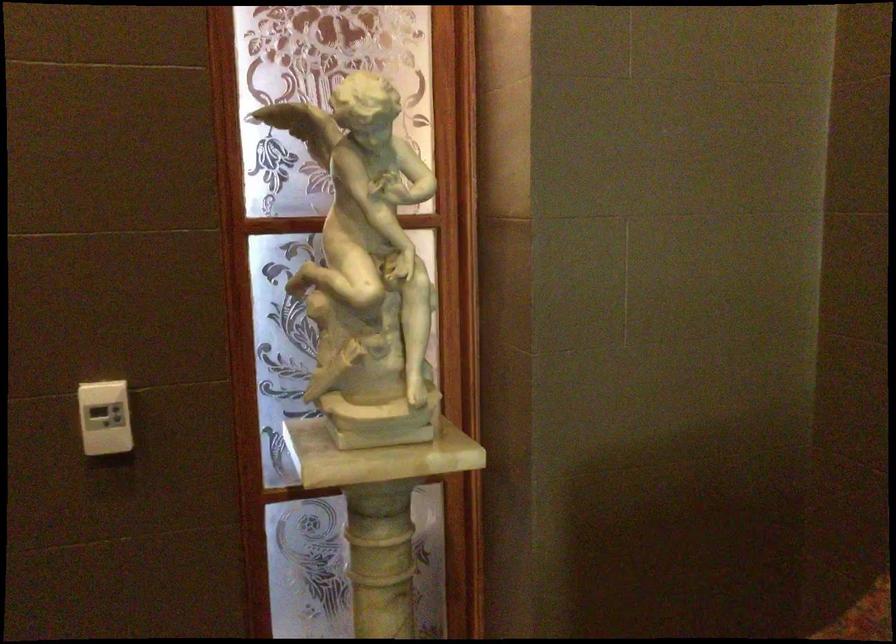
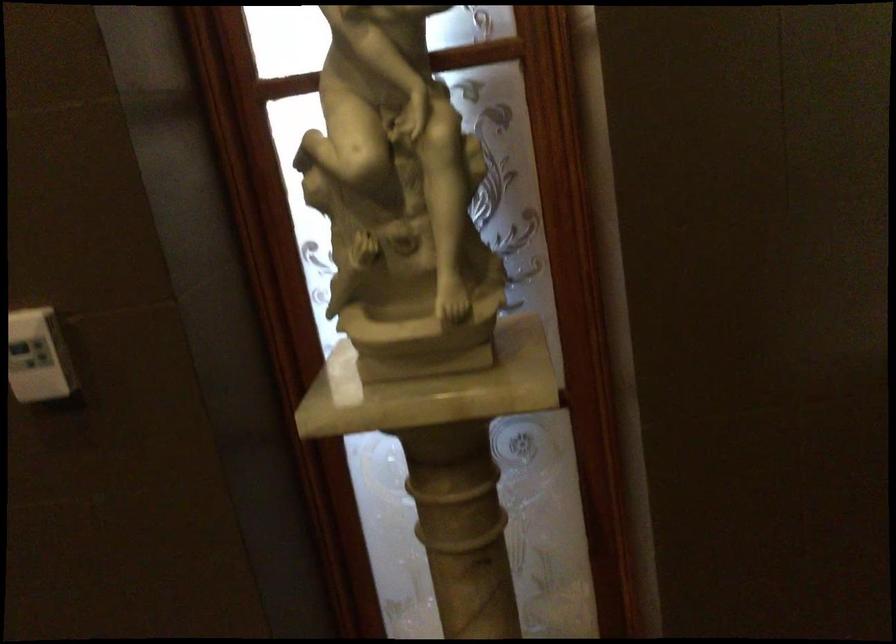
The images are taken continuously from a first-person perspective. In which direction are you moving?

The movement direction of the cameraman is right, forward.